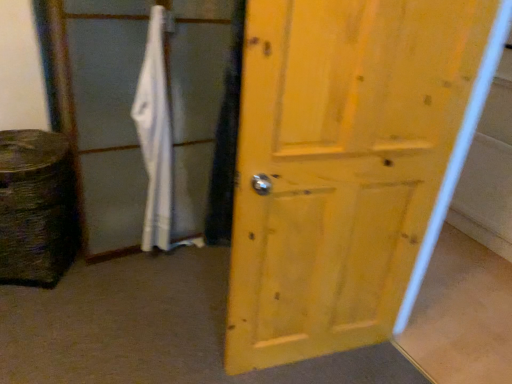
This screenshot has width=512, height=384. I want to click on vacant position to the left of yellow wood door at center, so click(x=187, y=327).